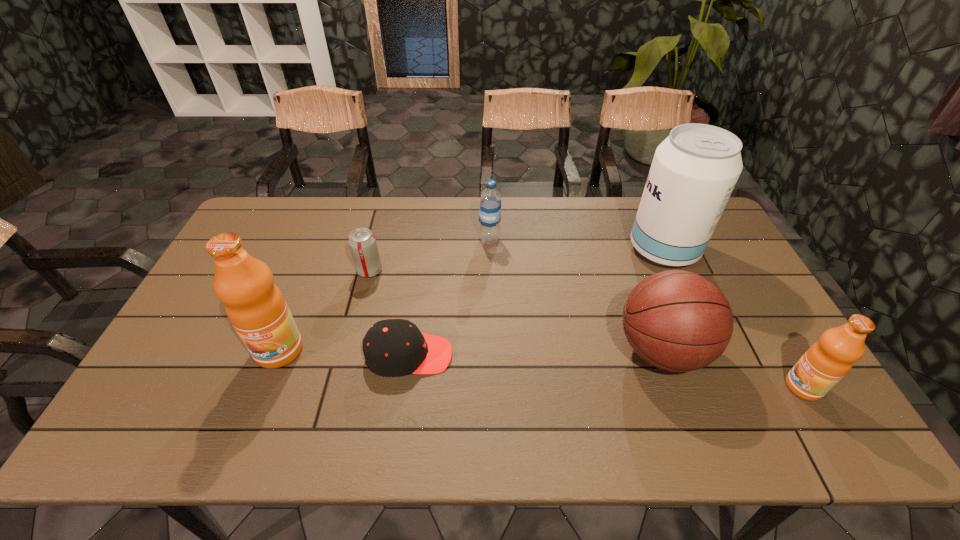
The height and width of the screenshot is (540, 960). What are the coordinates of `object that is at the near right corner` in the screenshot? It's located at (827, 361).

In the image, there is a desktop. Where is `free region at the far edge`? free region at the far edge is located at coordinates (324, 212).

You are a GUI agent. You are given a task and a screenshot of the screen. Output one action in this format:
    pyautogui.click(x=<x>, y=<y>)
    Task: Click on the vacant space at the left edge
    Image resolution: width=960 pixels, height=540 pixels.
    Given the screenshot: What is the action you would take?
    pyautogui.click(x=220, y=309)

I want to click on vacant space at the right edge, so click(737, 262).

You are a GUI agent. You are given a task and a screenshot of the screen. Output one action in this format:
    pyautogui.click(x=<x>, y=<y>)
    Task: Click on the vacant region at the far left corner of the desktop
    The image size is (960, 540).
    Given the screenshot: What is the action you would take?
    pyautogui.click(x=274, y=202)

The image size is (960, 540). In order to click on free space between the shortest object and the basketball in this screenshot , I will do `click(535, 353)`.

I want to click on empty location between the shortest object and the alcohol, so click(537, 302).

At what (x,y) coordinates should I click in order to perform the action: click on vacant area between the sixth object from right to left and the basketball. Please return your answer as a coordinate pair (x, y). The image size is (960, 540). Looking at the image, I should click on (516, 310).

I want to click on unoccupied area between the alcohol and the water bottle, so click(577, 245).

Locate an element on the screen. The height and width of the screenshot is (540, 960). free spot between the fifth object from right to left and the farther fruit juice is located at coordinates click(x=344, y=353).